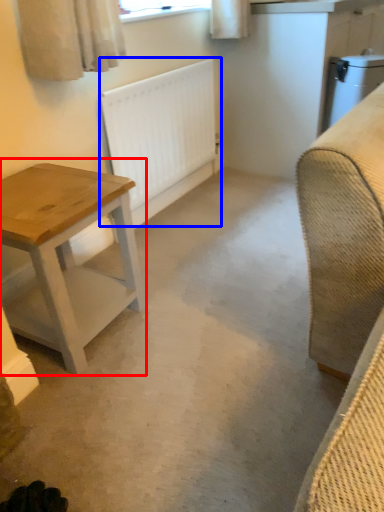
Question: Which of the following is the farthest to the observer, table (highlighted by a red box) or radiator (highlighted by a blue box)?

Choices:
 (A) table
 (B) radiator

Answer: (B)